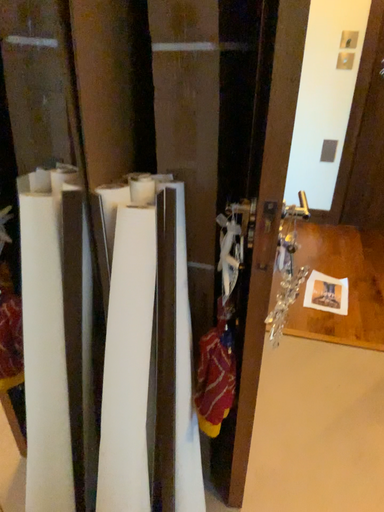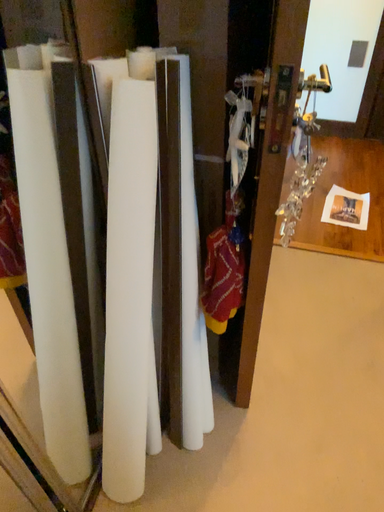
Question: Which way did the camera rotate in the video?

Choices:
 (A) rotated downward
 (B) rotated upward

Answer: (A)